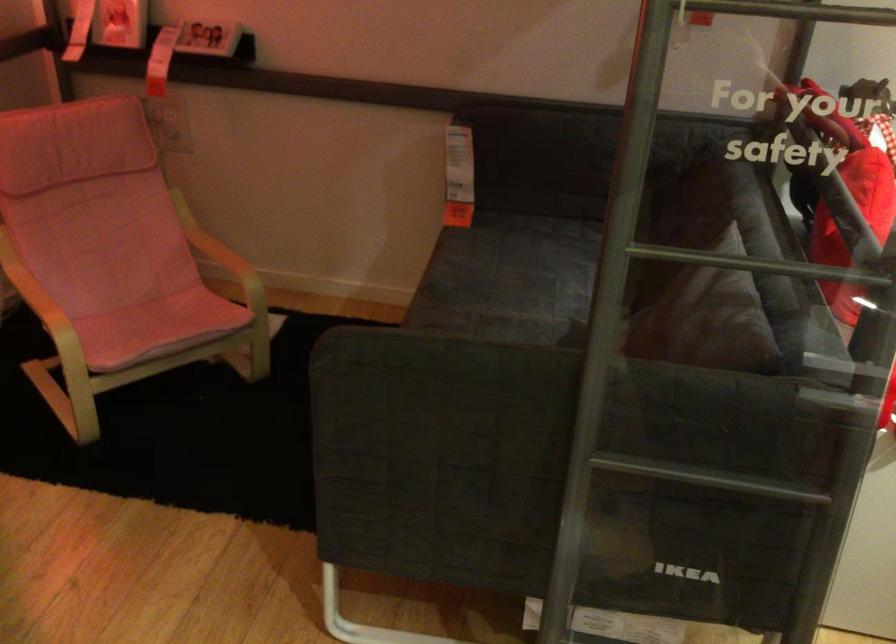
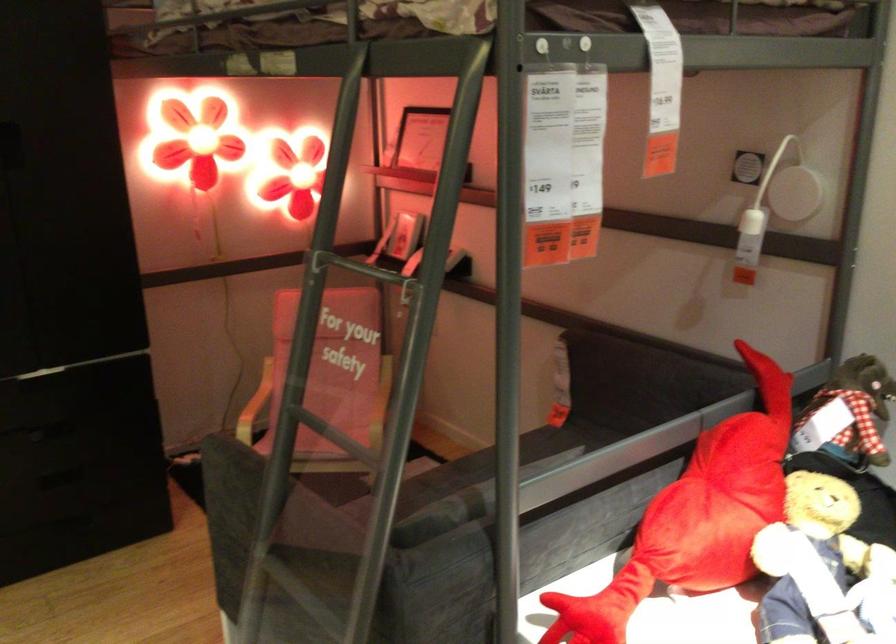
Locate, in the second image, the point that corresponds to (x=785, y=277) in the first image.

(340, 448)